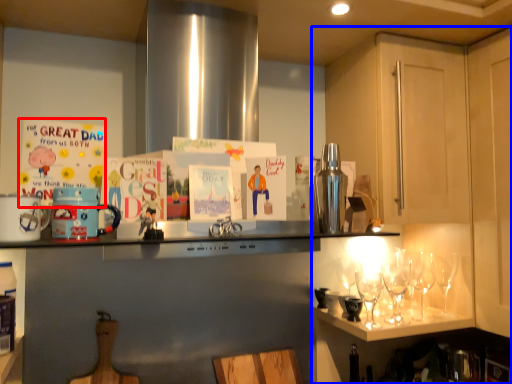
Question: Which object appears closest to the camera in this image, postcard (highlighted by a red box) or cabinetry (highlighted by a blue box)?

Choices:
 (A) postcard
 (B) cabinetry

Answer: (B)